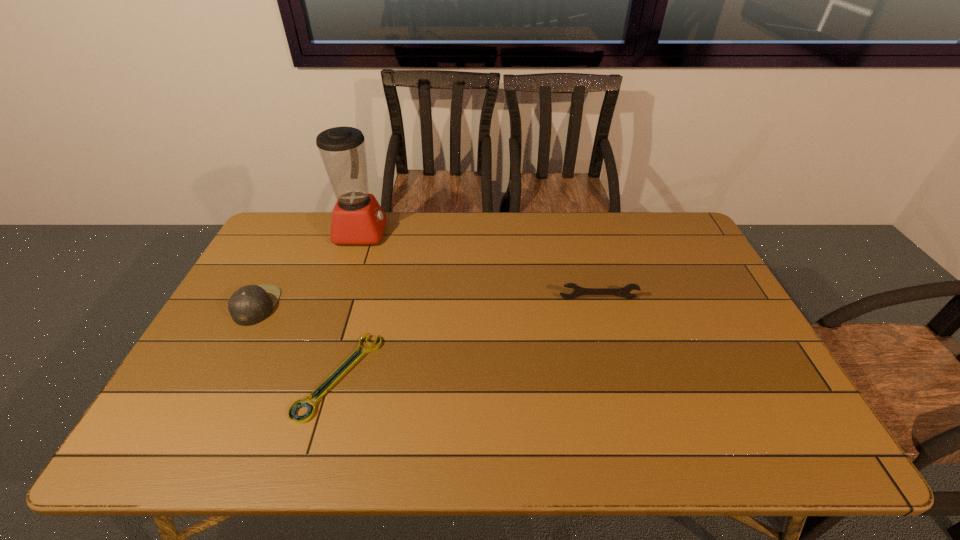
At what (x,y) coordinates should I click in order to perform the action: click on free space between the leftmost object and the farthest object. Please return your answer as a coordinate pair (x, y). Looking at the image, I should click on (309, 268).

I want to click on free space between the farthest object and the farther wrench, so click(x=480, y=265).

The width and height of the screenshot is (960, 540). Find the location of `unoccupied position between the blender and the shorter wrench`. unoccupied position between the blender and the shorter wrench is located at coordinates pos(350,304).

Locate an element on the screen. vacant point located between the second shortest object and the left wrench is located at coordinates (468, 337).

Where is `vacant point located between the cap and the nearest object`? vacant point located between the cap and the nearest object is located at coordinates (298, 341).

Where is `vacant area that lies between the second shortest object and the leftmost object`? The image size is (960, 540). vacant area that lies between the second shortest object and the leftmost object is located at coordinates (427, 302).

Find the location of a particular element. The width and height of the screenshot is (960, 540). empty location between the left wrench and the third tallest object is located at coordinates (468, 337).

Where is `free space between the cap and the blender`? free space between the cap and the blender is located at coordinates (309, 268).

Identify the location of unoccupied area between the third tallest object and the cap. The image size is (960, 540). (x=427, y=302).

The image size is (960, 540). I want to click on vacant point located between the farthest object and the nearer wrench, so click(x=350, y=304).